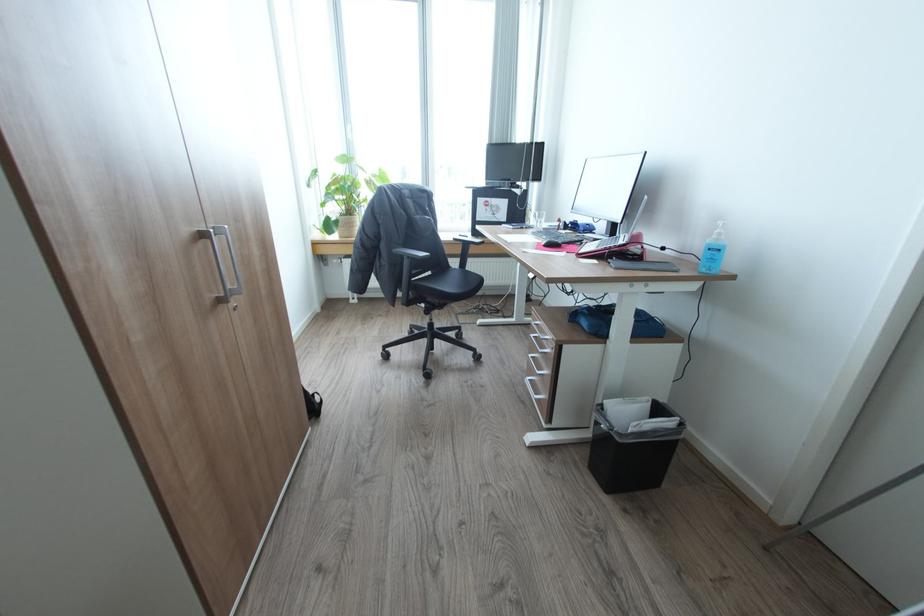
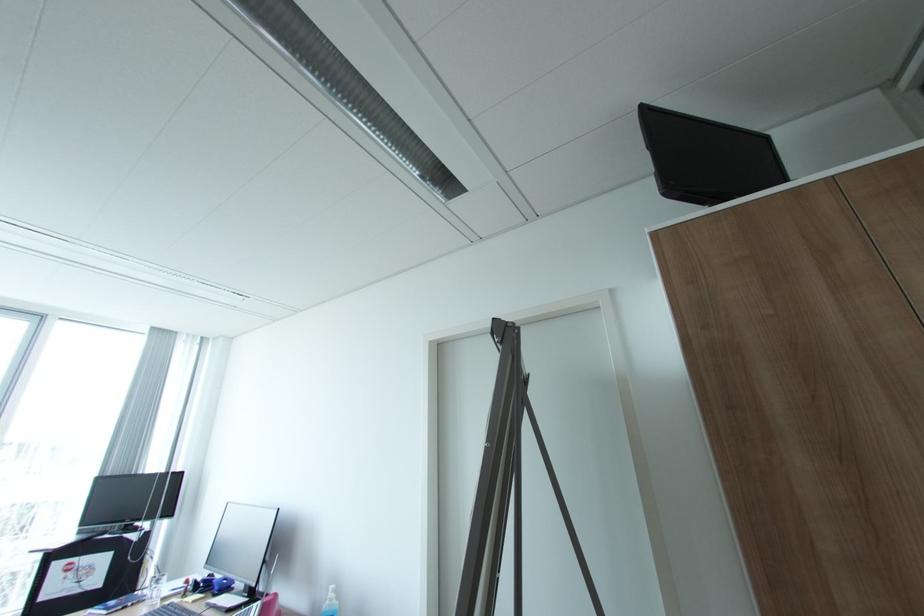
Where in the second image is the point corresponding to (x=723, y=233) from the first image?

(336, 599)